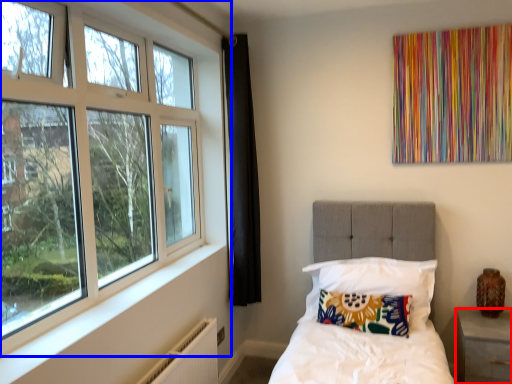
Question: Which of the following is the closest to the observer, nightstand (highlighted by a red box) or window (highlighted by a blue box)?

Choices:
 (A) nightstand
 (B) window

Answer: (B)